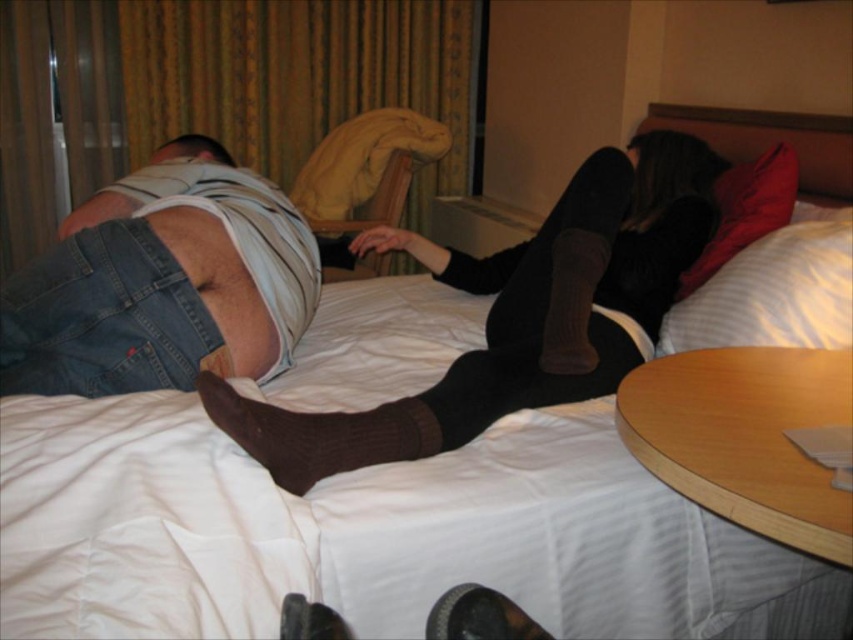
Can you confirm if white striped pillow at upper right is positioned above brown knitted sock at center?

Indeed, white striped pillow at upper right is positioned over brown knitted sock at center.

Measure the distance between white striped pillow at upper right and brown knitted sock at center.

The distance of white striped pillow at upper right from brown knitted sock at center is 29.31 inches.

Is point (782, 317) positioned before point (399, 454)?

No, it is not.

Where is `white striped pillow at upper right`? This screenshot has width=853, height=640. white striped pillow at upper right is located at coordinates (775, 291).

Consider the image. Does white striped pillow at upper right come behind red soft pillow at upper right?

No.

Is point (674, 316) less distant than point (682, 275)?

Yes, it is in front of point (682, 275).

Locate an element on the screen. Image resolution: width=853 pixels, height=640 pixels. white striped pillow at upper right is located at coordinates (775, 291).

Does black ribbed socks at center appear over brown knitted sock at center?

Yes.

Does black ribbed socks at center have a smaller size compared to brown knitted sock at center?

No, black ribbed socks at center is not smaller than brown knitted sock at center.

Locate an element on the screen. This screenshot has width=853, height=640. black ribbed socks at center is located at coordinates (517, 316).